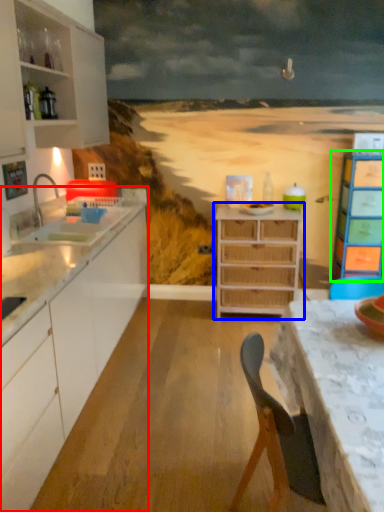
Question: Which is nearer to the cabinetry (highlighted by a red box)? chest of drawers (highlighted by a blue box) or chest of drawers (highlighted by a green box).

Choices:
 (A) chest of drawers
 (B) chest of drawers

Answer: (A)